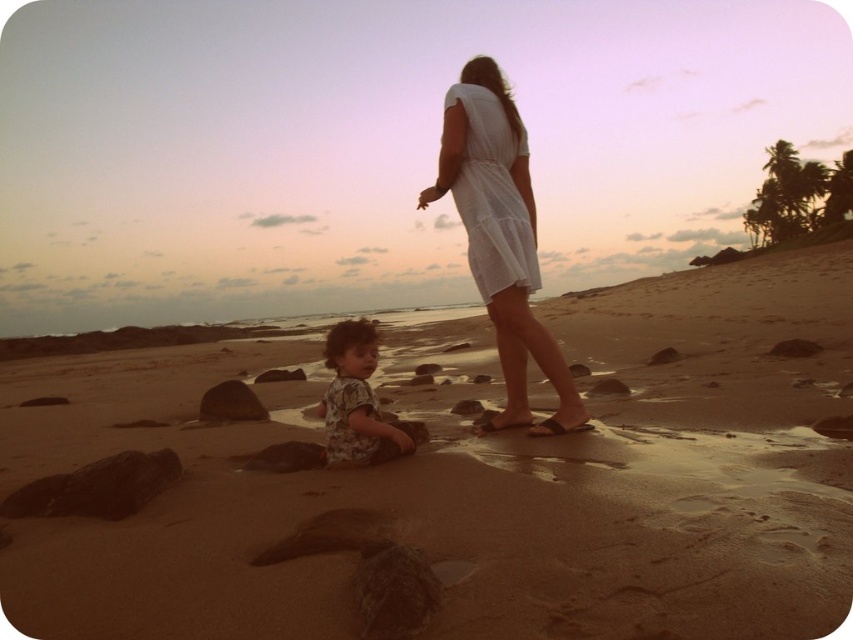
Between white cotton dress at center and smooth brown rock at lower center, which one is positioned higher?

white cotton dress at center is higher up.

From the picture: Is white cotton dress at center positioned behind smooth brown rock at lower center?

No, it is not.

Between point (480, 296) and point (281, 374), which one is positioned behind?

The point (281, 374) is more distant.

Where is `white cotton dress at center`? white cotton dress at center is located at coordinates (498, 230).

Is point (228, 621) less distant than point (212, 412)?

Yes.

Between sandy brown sand at center and smooth brown rock at lower left, which one is positioned lower?

smooth brown rock at lower left

This screenshot has height=640, width=853. I want to click on sandy brown sand at center, so click(473, 480).

Which is in front, point (517, 284) or point (361, 435)?

Point (361, 435) is more forward.

Is point (445, 180) closer to viewer compared to point (335, 346)?

No, it is not.

The image size is (853, 640). I want to click on white cotton dress at center, so click(498, 230).